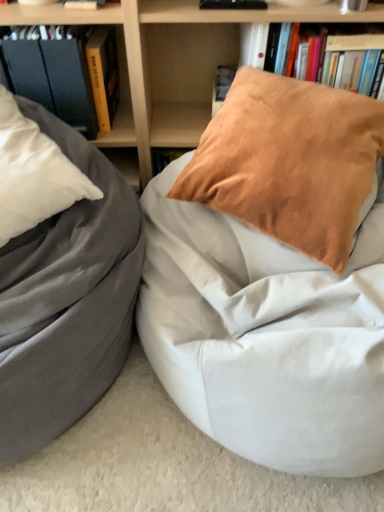
I want to click on matte black bookshelf at upper left, so click(58, 14).

Measure the distance between point (117, 146) and camera.

4.34 feet.

What is the approximate height of white fabric bean bag at center?

19.63 inches.

The width and height of the screenshot is (384, 512). I want to click on white fabric bean bag at center, so click(266, 335).

Identify the location of hardcover book at left. This screenshot has height=512, width=384. (70, 77).

Is matte black book at upper left, acting as the 1th book starting from the left, oriented towards hardcover book at left?

No, matte black book at upper left, acting as the 1th book starting from the left, is not facing towards hardcover book at left.

Is matte black book at upper left, acting as the 1th book starting from the left, placed right next to hardcover book at left?

Yes, matte black book at upper left, acting as the 1th book starting from the left, is next to hardcover book at left.

Which is nearer, (90,132) or (52,78)?

Point (90,132) is farther from the camera than point (52,78).

Considering their positions, is matte black bookshelf at upper left located in front of or behind matte black book at upper left, placed as the third book when sorted from right to left?

Visually, matte black bookshelf at upper left is located in front of matte black book at upper left, placed as the third book when sorted from right to left.

Between matte black bookshelf at upper left and matte black book at upper left, placed as the third book when sorted from right to left, which one has smaller width?

Thinner between the two is matte black book at upper left, placed as the third book when sorted from right to left.

Can you confirm if matte black bookshelf at upper left is bigger than matte black book at upper left, placed as the third book when sorted from right to left?

Yes, matte black bookshelf at upper left is bigger than matte black book at upper left, placed as the third book when sorted from right to left.

Would you say matte black bookshelf at upper left is to the left or to the right of matte black book at upper left, acting as the 1th book starting from the left, in the picture?

From the image, it's evident that matte black bookshelf at upper left is to the right of matte black book at upper left, acting as the 1th book starting from the left.

Find the location of `book below the yellow hardcover book at upper left, which is the 2th book from left to right (from the image's perspective)`. book below the yellow hardcover book at upper left, which is the 2th book from left to right (from the image's perspective) is located at coordinates (54, 72).

Which is less distant, (x=90, y=65) or (x=24, y=64)?

Point (x=90, y=65) is farther from the camera than point (x=24, y=64).

Is the depth of yellow hardcover book at upper left, arranged as the second book when viewed from the right, greater than that of matte black book at upper left, placed as the third book when sorted from right to left?

Yes, it is behind matte black book at upper left, placed as the third book when sorted from right to left.

Based on the photo, from the image's perspective, is matte black bookshelf at upper left located beneath hardcover book at left?

Correct, matte black bookshelf at upper left appears lower than hardcover book at left in the image.

From a real-world perspective, does matte black bookshelf at upper left sit lower than hardcover book at left?

No.

Does point (128, 84) come closer to viewer compared to point (48, 80)?

No.

Based on the photo, can we say matte black bookshelf at upper left lies outside hardcover book at left?

matte black bookshelf at upper left is positioned outside hardcover book at left.

Does yellow hardcover book at upper left, which is the 2th book from left to right, turn towards matte black bookshelf at upper left?

Yes, yellow hardcover book at upper left, which is the 2th book from left to right, is oriented towards matte black bookshelf at upper left.

Considering the sizes of objects yellow hardcover book at upper left, which is the 2th book from left to right, and matte black bookshelf at upper left in the image provided, who is bigger, yellow hardcover book at upper left, which is the 2th book from left to right, or matte black bookshelf at upper left?

With larger size is matte black bookshelf at upper left.

Which is more to the right, yellow hardcover book at upper left, which is the 2th book from left to right, or matte black bookshelf at upper left?

yellow hardcover book at upper left, which is the 2th book from left to right.

Is yellow hardcover book at upper left, which is the 2th book from left to right, far away from white fabric bean bag at center?

No, yellow hardcover book at upper left, which is the 2th book from left to right, is not far from white fabric bean bag at center.

How many degrees apart are the facing directions of yellow hardcover book at upper left, arranged as the second book when viewed from the right, and white fabric bean bag at center?

There is a 0.749-degree angle between the facing directions of yellow hardcover book at upper left, arranged as the second book when viewed from the right, and white fabric bean bag at center.

Is yellow hardcover book at upper left, arranged as the second book when viewed from the right, turned away from white fabric bean bag at center?

No, yellow hardcover book at upper left, arranged as the second book when viewed from the right, is not facing the opposite direction of white fabric bean bag at center.

Image resolution: width=384 pixels, height=512 pixels. I want to click on mattress that appears below the hardcover book at upper center, which ranks as the 3th book in left-to-right order (from the image's perspective), so click(266, 335).

How many degrees apart are the facing directions of hardcover book at upper center, placed as the 1th book when sorted from right to left, and white fabric bean bag at center?

There is a 0.0516-degree angle between the facing directions of hardcover book at upper center, placed as the 1th book when sorted from right to left, and white fabric bean bag at center.

From a real-world perspective, which object rests below the other?

white fabric bean bag at center.

Is hardcover book at upper center, which ranks as the 3th book in left-to-right order, positioned in front of white fabric bean bag at center?

No, hardcover book at upper center, which ranks as the 3th book in left-to-right order, is behind white fabric bean bag at center.

Locate an element on the screen. The height and width of the screenshot is (512, 384). book that is the 1st one when counting backward from the hardcover book at left is located at coordinates tap(54, 72).

The image size is (384, 512). I want to click on shelf in front of the matte black book at upper left, placed as the third book when sorted from right to left, so click(x=58, y=14).

Estimate the real-world distances between objects in this image. Which object is further from hardcover book at left, matte black book at upper left, placed as the third book when sorted from right to left, or wooden bookshelf at upper center?

wooden bookshelf at upper center.

When comparing their distances from hardcover book at upper center, placed as the 1th book when sorted from right to left, does matte black bookshelf at upper left or wooden bookshelf at upper center seem closer?

Among the two, wooden bookshelf at upper center is located nearer to hardcover book at upper center, placed as the 1th book when sorted from right to left.

Which object lies nearer to the anchor point matte black bookshelf at upper left, matte gray bean bag at left or wooden bookshelf at upper center?

wooden bookshelf at upper center is closer to matte black bookshelf at upper left.

Which object lies further to the anchor point matte gray bean bag at left, wooden bookshelf at upper center or matte black book at upper left, placed as the third book when sorted from right to left?

Based on the image, wooden bookshelf at upper center appears to be further to matte gray bean bag at left.

Based on the photo, when comparing their distances from hardcover book at left, does wooden bookshelf at upper center or yellow hardcover book at upper left, which is the 2th book from left to right, seem further?

wooden bookshelf at upper center.

Based on their spatial positions, is matte black bookshelf at upper left or matte gray bean bag at left further from yellow hardcover book at upper left, which is the 2th book from left to right?

matte gray bean bag at left.

Considering their positions, is wooden bookshelf at upper center positioned further to matte black book at upper left, acting as the 1th book starting from the left, than suede orange pillow at upper right?

The object further to matte black book at upper left, acting as the 1th book starting from the left, is suede orange pillow at upper right.

Looking at the image, which one is located closer to hardcover book at upper center, which ranks as the 3th book in left-to-right order, yellow hardcover book at upper left, arranged as the second book when viewed from the right, or matte black book at upper left, acting as the 1th book starting from the left?

The object closer to hardcover book at upper center, which ranks as the 3th book in left-to-right order, is yellow hardcover book at upper left, arranged as the second book when viewed from the right.

This screenshot has width=384, height=512. Identify the location of pillow between hardcover book at upper center, placed as the 1th book when sorted from right to left, and white fabric bean bag at center, in the vertical direction. (289, 162).

Find the location of a particular element. The image size is (384, 512). bookcase between matte black book at upper left, acting as the 1th book starting from the left, and hardcover book at upper center, placed as the 1th book when sorted from right to left is located at coordinates (171, 62).

The width and height of the screenshot is (384, 512). I want to click on bookcase that lies between yellow hardcover book at upper left, which is the 2th book from left to right, and white fabric bean bag at center from top to bottom, so click(x=171, y=62).

The image size is (384, 512). Identify the location of paperback book located between matte black book at upper left, acting as the 1th book starting from the left, and yellow hardcover book at upper left, arranged as the second book when viewed from the right, in the left-right direction. (70, 77).